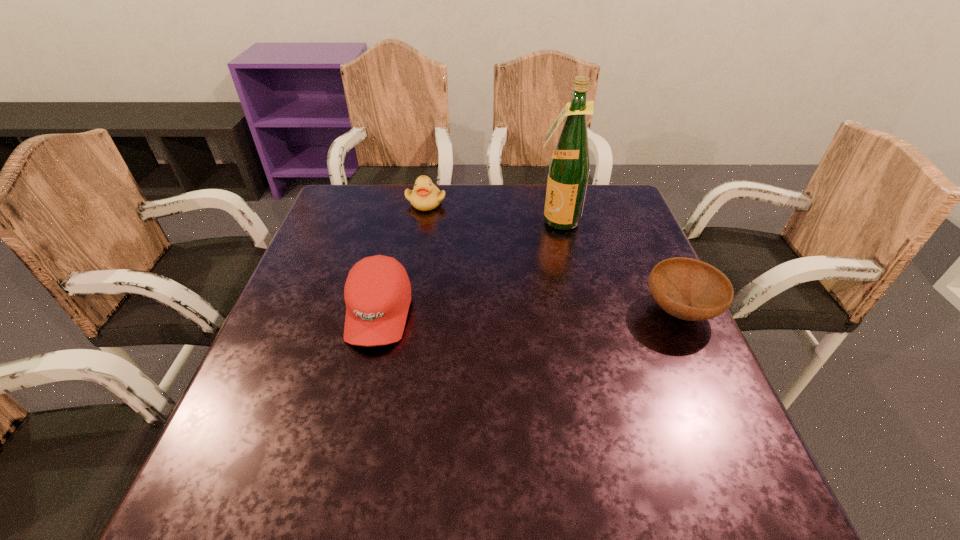
The image size is (960, 540). Identify the location of vacant space located 0.240m on the beak of the duckling. (467, 260).

What are the coordinates of `blank space located 0.050m on the beak of the duckling` in the screenshot? It's located at (440, 221).

Find the location of a particular element. vacant area situated 0.100m on the beak of the duckling is located at coordinates (445, 231).

Identify the location of liquor that is positioned at the far edge. The height and width of the screenshot is (540, 960). (569, 167).

The width and height of the screenshot is (960, 540). What are the coordinates of `duckling that is at the far edge` in the screenshot? It's located at point(425,196).

This screenshot has width=960, height=540. What are the coordinates of `object present at the left edge` in the screenshot? It's located at (377, 293).

The image size is (960, 540). Identify the location of object that is at the right edge. (689, 289).

Locate an element on the screen. The height and width of the screenshot is (540, 960). vacant space at the far edge of the desktop is located at coordinates (492, 193).

At what (x,y) coordinates should I click in order to perform the action: click on blank space at the near edge. Please return your answer as a coordinate pair (x, y). This screenshot has width=960, height=540. Looking at the image, I should click on (623, 431).

Where is `vacant space at the left edge of the desktop`? vacant space at the left edge of the desktop is located at coordinates tap(295, 292).